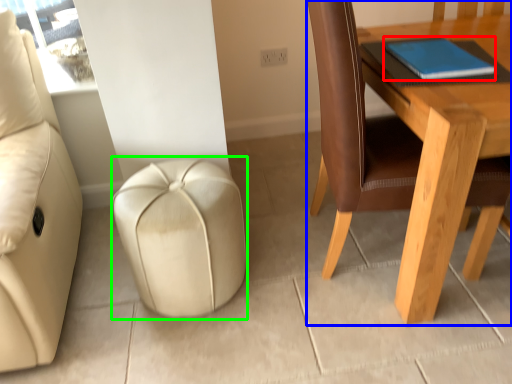
Question: Estimate the real-world distances between objects in this image. Which object is closer to notebook (highlighted by a red box), table (highlighted by a blue box) or stool (highlighted by a green box)?

Choices:
 (A) table
 (B) stool

Answer: (A)